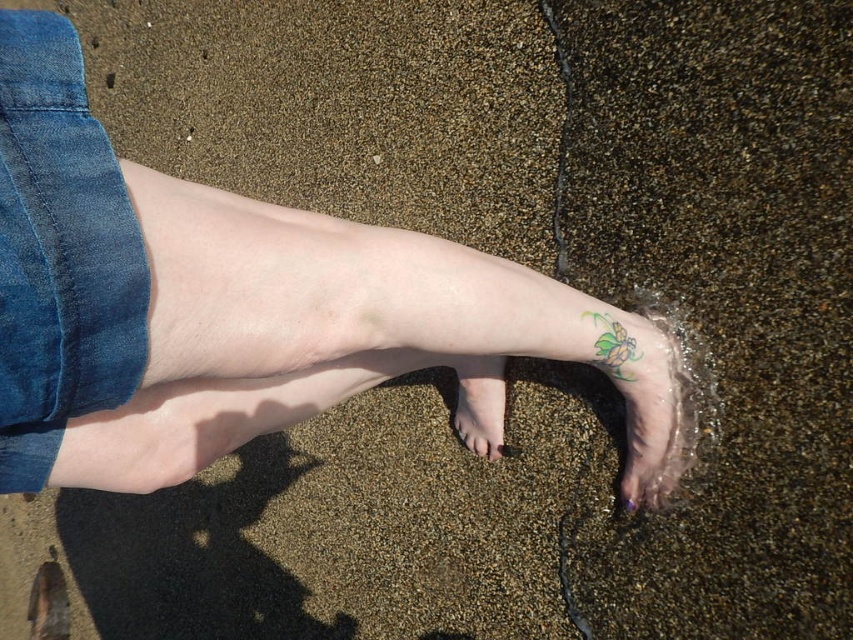
Does point (38, 193) lie in front of point (485, 444)?

Yes, it is.

Locate an element on the screen. This screenshot has height=640, width=853. pale skin leg at center is located at coordinates (206, 298).

Which is behind, point (13, 353) or point (494, 358)?

Positioned behind is point (494, 358).

You are a GUI agent. You are given a task and a screenshot of the screen. Output one action in this format:
    pyautogui.click(x=<x>, y=<y>)
    Task: Click on the pale skin leg at center
    The height and width of the screenshot is (640, 853).
    Given the screenshot: What is the action you would take?
    pyautogui.click(x=206, y=298)

Between pale skin leg at center and purple glossy toe at lower center, which one is positioned higher?

Positioned higher is pale skin leg at center.

Is pale skin leg at center further to camera compared to purple glossy toe at lower center?

No, it is not.

Does point (242, 216) come in front of point (628, 502)?

Yes, point (242, 216) is in front of point (628, 502).

This screenshot has height=640, width=853. Find the location of `pale skin leg at center`. pale skin leg at center is located at coordinates coord(206,298).

Does green matte butterfly at lower right have a smaller size compared to purple glossy toe at lower center?

Incorrect, green matte butterfly at lower right is not smaller in size than purple glossy toe at lower center.

Measure the distance from green matte butterfly at lower right to purple glossy toe at lower center.

green matte butterfly at lower right is 19.82 centimeters away from purple glossy toe at lower center.

Which is behind, point (619, 365) or point (630, 506)?

The point (630, 506) is behind.

The height and width of the screenshot is (640, 853). What are the coordinates of `green matte butterfly at lower right` in the screenshot? It's located at (613, 346).